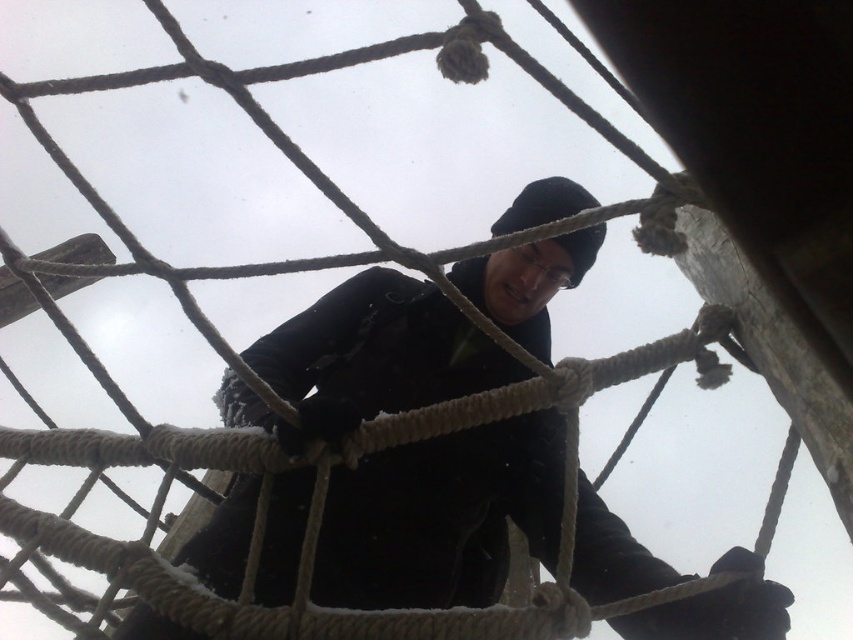
You are a photographer standing at the base of the obstacle course. You want to take a photo of the black matte jacket at center. If your camera can focus on objects within 1.5 meters, will the jacket be in focus?

The black matte jacket at center is 1.48 meters away from camera, so yes, it will be in focus since it is within the camera focus range of 1.5 meters.

You are a photographer trying to capture the climber from below. You notice the black matte jacket at center and the black woolen hat at upper center. Which object should you focus on first if you want to photograph the climber from this angle?

The black woolen hat at upper center should be focused on first because it is positioned higher than the black matte jacket at center.

You are a photographer trying to capture a clear photo of the climber. The camera you have can only focus on objects within a 40 cm width. You notice the black matte jacket at center and the black woolen hat at upper center. Which object should you focus on to ensure it fits within the camera frame?

The black matte jacket at center might be wider than black woolen hat at upper center. Since the camera can only focus on objects within 40 cm width, you should focus on the black woolen hat at upper center to ensure it fits within the frame.